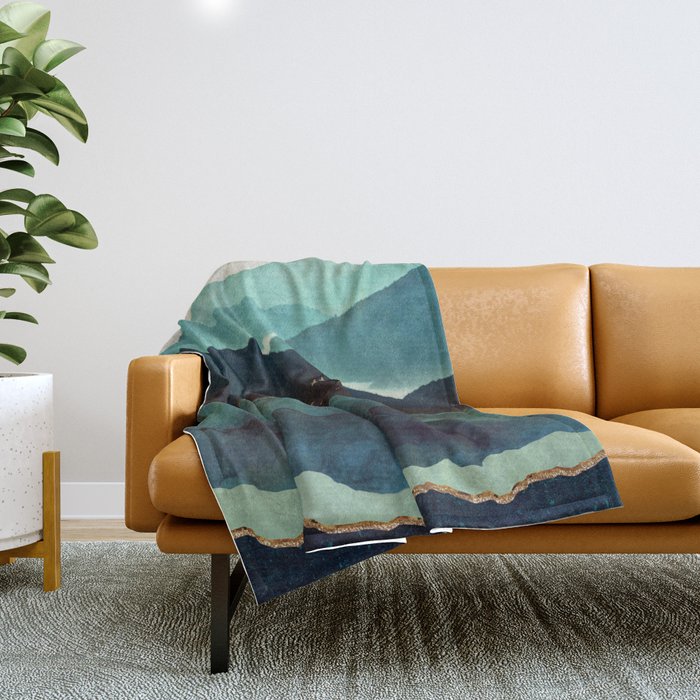
Locate an element on the screen. The height and width of the screenshot is (700, 700). wood floor is located at coordinates (71, 533).